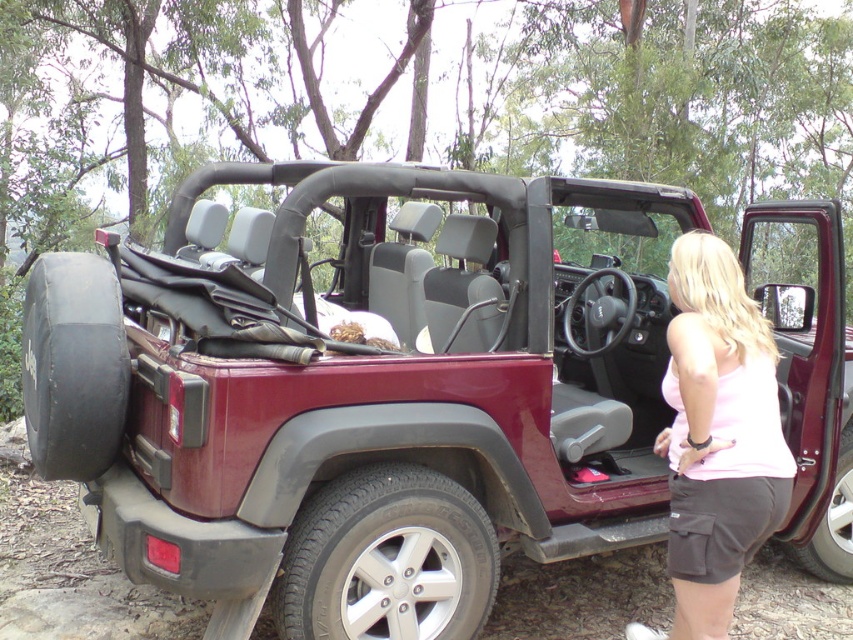
Between maroon matte jeep at center and pink cotton tank top at center, which one has less height?

pink cotton tank top at center is shorter.

Does maroon matte jeep at center have a smaller size compared to pink cotton tank top at center?

No, maroon matte jeep at center is not smaller than pink cotton tank top at center.

Does point (418, 333) come farther from viewer compared to point (778, 436)?

Yes, point (418, 333) is farther from viewer.

At what (x,y) coordinates should I click in order to perform the action: click on maroon matte jeep at center. Please return your answer as a coordinate pair (x, y). Looking at the image, I should click on (360, 394).